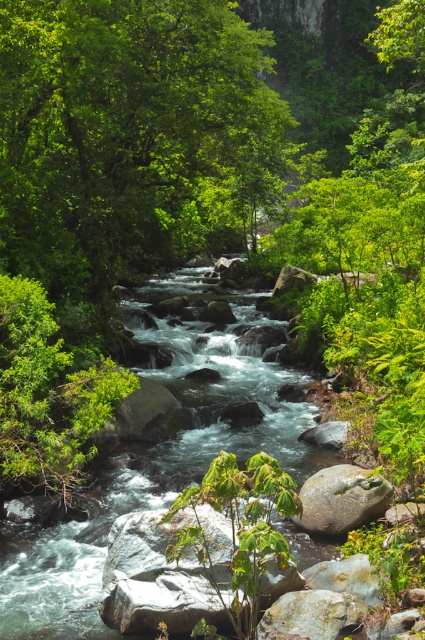
Who is positioned more to the right, gray smooth rock at center-right or rusty metallic rock at center?

gray smooth rock at center-right is more to the right.

I want to click on gray smooth rock at center-right, so click(x=342, y=499).

Is green leafy tree at left closer to camera compared to gray smooth rock at center-right?

Yes, it is in front of gray smooth rock at center-right.

From the picture: Between green leafy tree at left and gray smooth rock at center-right, which one is positioned higher?

green leafy tree at left is above.

Is point (57, 419) positioned after point (379, 497)?

Yes, it is.

This screenshot has width=425, height=640. Find the location of `green leafy tree at left`. green leafy tree at left is located at coordinates [x=48, y=394].

Between green leafy tree at left and rusty metallic rock at center, which one is positioned lower?

rusty metallic rock at center

Does green leafy tree at left have a lesser width compared to rusty metallic rock at center?

No.

The image size is (425, 640). Find the location of `green leafy tree at left`. green leafy tree at left is located at coordinates (48, 394).